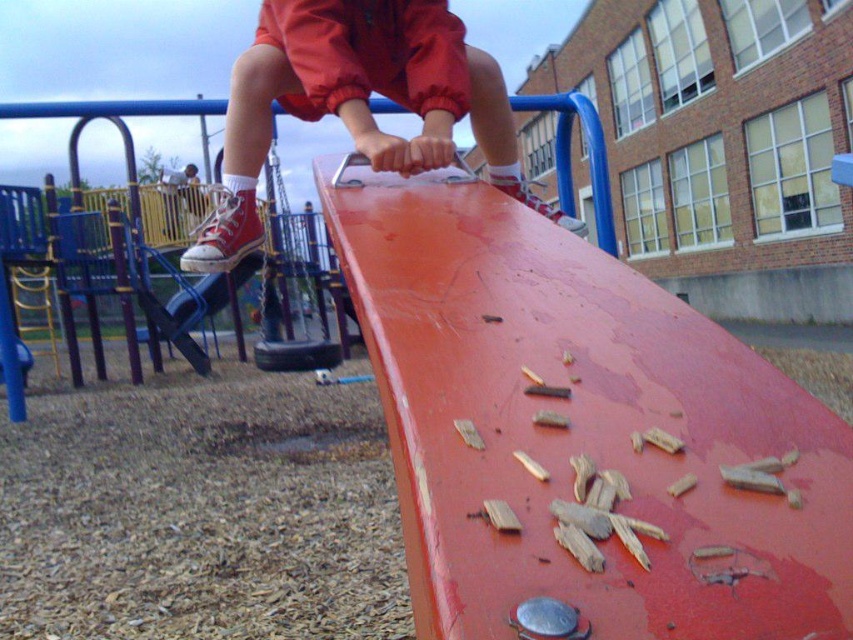
You are a parent at the playground. You see your child wearing the matte red sneakers at upper center and notice the rubberized black swing at center. Which object is smaller in size?

The matte red sneakers at upper center is smaller than the rubberized black swing at center.

You are standing at the entrance of the playground, which is at point 0.0, 0.0. You want to go to the smooth red ramp at center. Which direction should you go?

The smooth red ramp at center is located at point (579, 428), so you should go northeast to reach it.

You are a parent trying to decide which play equipment to let your child use first. You see the smooth red ramp at center and the rubberized black swing at center. Which one is shorter?

The smooth red ramp at center is shorter than the rubberized black swing at center.